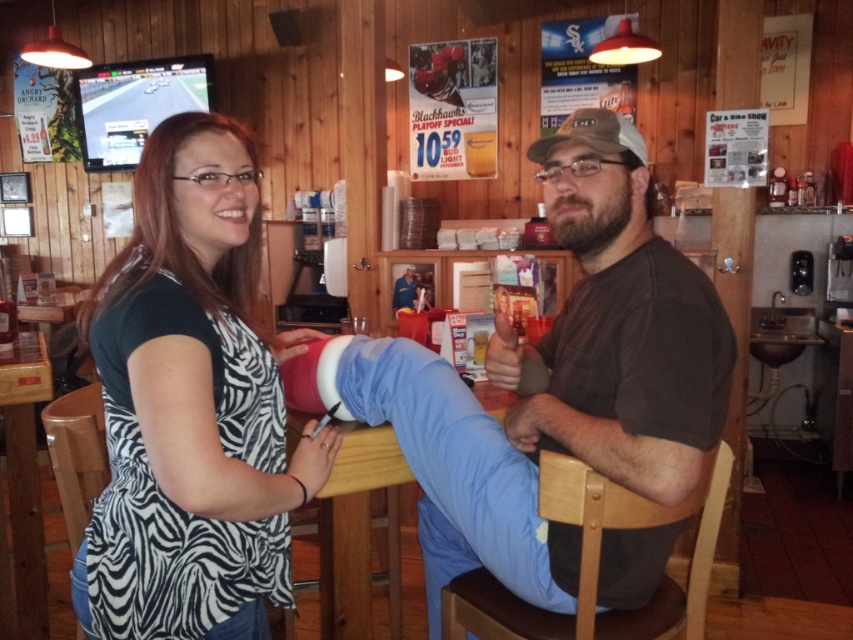
Question: Is zebra print shirt at left above brown cotton shirt at center?

Choices:
 (A) yes
 (B) no

Answer: (A)

Question: Is the position of zebra print shirt at left less distant than that of brown cotton shirt at center?

Choices:
 (A) no
 (B) yes

Answer: (B)

Question: Is the position of zebra print shirt at left more distant than that of brown cotton shirt at center?

Choices:
 (A) yes
 (B) no

Answer: (B)

Question: Which of the following is the farthest from the observer?

Choices:
 (A) (631, 484)
 (B) (163, 560)

Answer: (A)

Question: Among these points, which one is nearest to the camera?

Choices:
 (A) (190, 486)
 (B) (538, 557)

Answer: (A)

Question: Which of the following is the farthest from the observer?

Choices:
 (A) zebra print shirt at left
 (B) brown cotton shirt at center

Answer: (B)